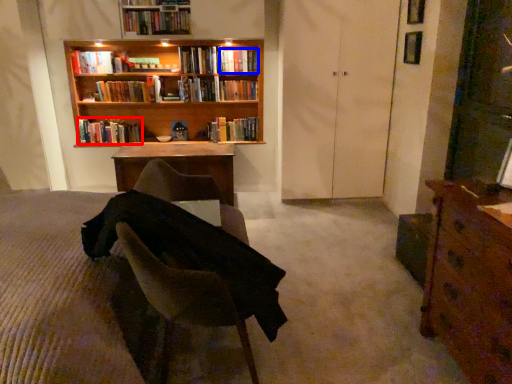
Question: Among these objects, which one is farthest to the camera, book (highlighted by a red box) or book (highlighted by a blue box)?

Choices:
 (A) book
 (B) book

Answer: (A)